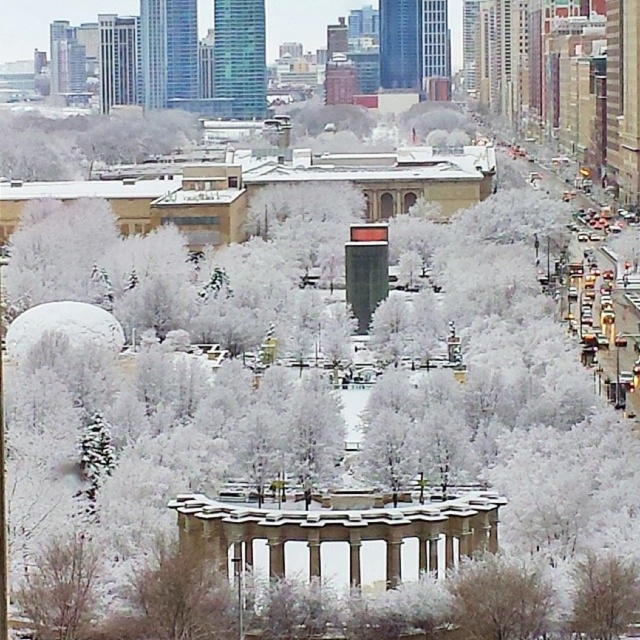
Question: Among these objects, which one is nearest to the camera?

Choices:
 (A) white frosty tree at center
 (B) white frosty tree at lower right

Answer: (A)

Question: From the image, what is the correct spatial relationship of white frosty tree at center in relation to white frosty tree at lower right?

Choices:
 (A) below
 (B) above

Answer: (A)

Question: Where is white frosty tree at center located in relation to white frosty tree at lower right in the image?

Choices:
 (A) above
 (B) below

Answer: (B)

Question: Is white frosty tree at center positioned in front of white frosty tree at lower right?

Choices:
 (A) no
 (B) yes

Answer: (B)